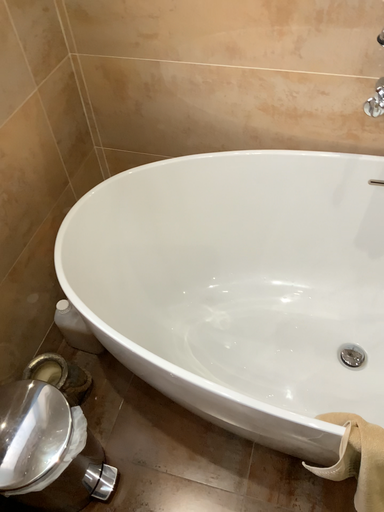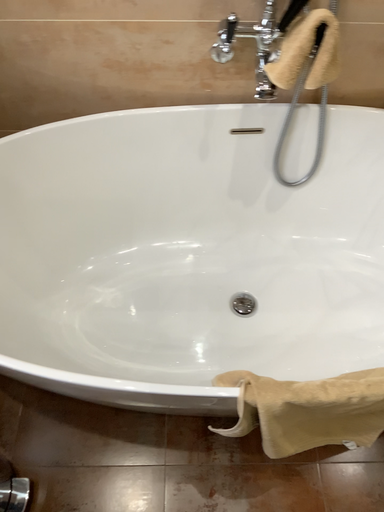
Question: How did the camera likely rotate when shooting the video?

Choices:
 (A) rotated left
 (B) rotated right

Answer: (B)